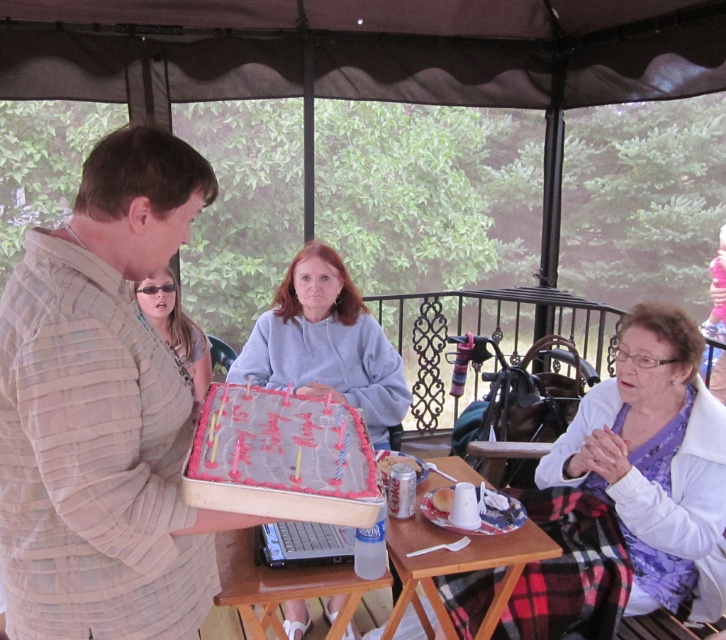
Between white fabric at lower right and matte gray hoodie at center, which one has less height?

matte gray hoodie at center is shorter.

Can you confirm if white fabric at lower right is positioned to the left of matte gray hoodie at center?

In fact, white fabric at lower right is to the right of matte gray hoodie at center.

Measure the distance between point (x=640, y=461) and camera.

A distance of 6.82 feet exists between point (x=640, y=461) and camera.

I want to click on white fabric at lower right, so click(645, 470).

Is light beige textured shirt at center thinner than matte gray hoodie at center?

Indeed, light beige textured shirt at center has a lesser width compared to matte gray hoodie at center.

Is light beige textured shirt at center closer to camera compared to matte gray hoodie at center?

Yes, it is.

Where is `light beige textured shirt at center`? light beige textured shirt at center is located at coordinates (99, 410).

Identify the location of pink frosted cake at center. Image resolution: width=726 pixels, height=640 pixels. (281, 458).